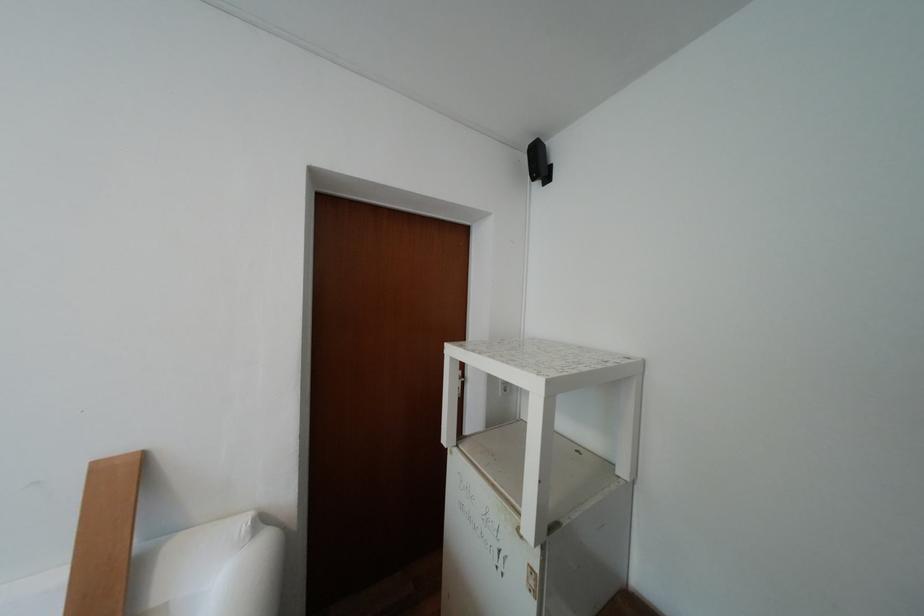
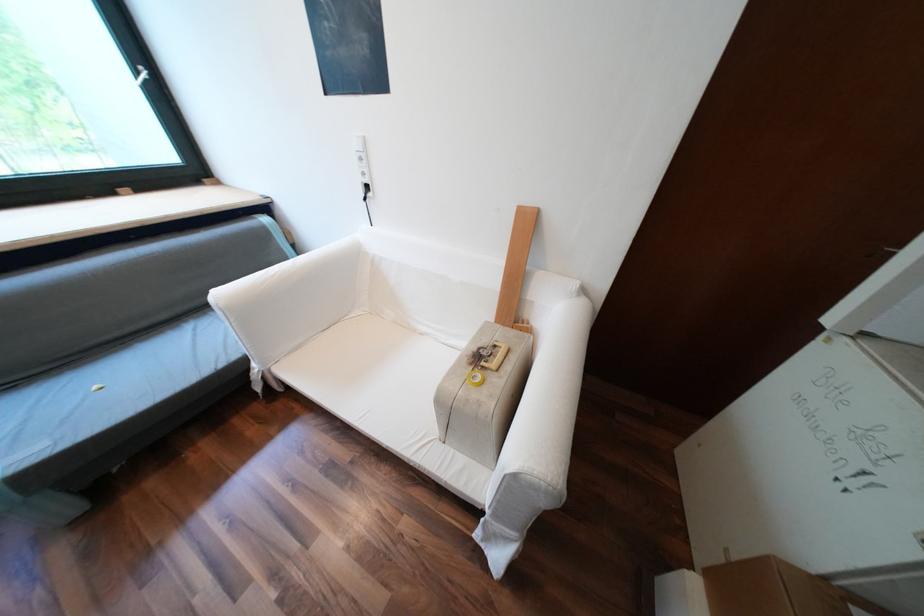
The first image is from the beginning of the video and the second image is from the end. How did the camera likely rotate when shooting the video?

The rotation direction of the camera is left-down.